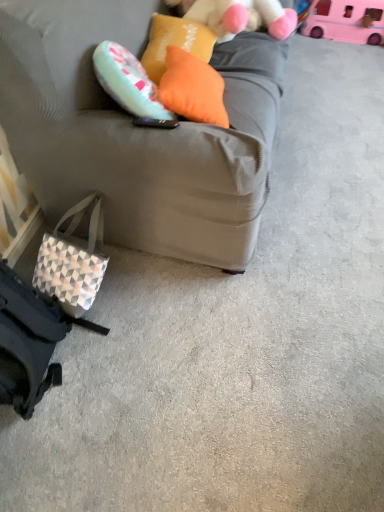
I want to click on free space that is in between matte gray couch at center and geometric-patterned fabric pouch at lower left, so click(x=153, y=298).